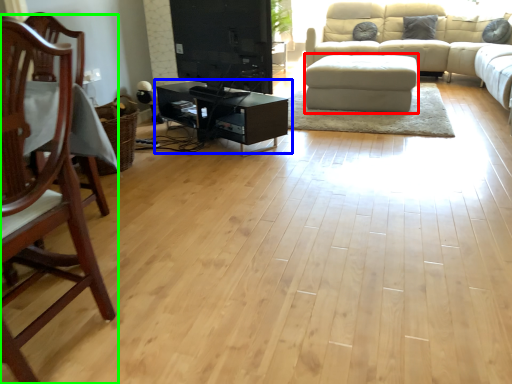
Question: Based on their relative distances, which object is farther from footrest (highlighted by a red box)? Choose from table (highlighted by a blue box) and chair (highlighted by a green box).

Choices:
 (A) table
 (B) chair

Answer: (B)